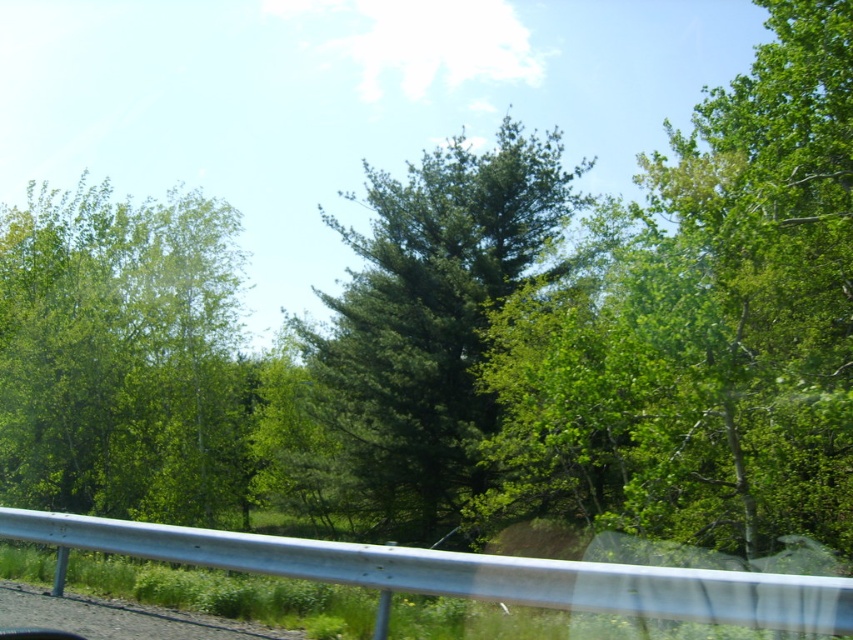
Describe the element at coordinates (701, 324) in the screenshot. I see `green leafy tree at center` at that location.

Between green leafy tree at center and green leafy tree at left, which one has more height?

With more height is green leafy tree at center.

Who is more distant from viewer, (711, 266) or (158, 333)?

The point (158, 333) is more distant.

I want to click on green leafy tree at center, so click(x=701, y=324).

Does green leafy tree at left have a larger size compared to green matte tree at center?

Indeed, green leafy tree at left has a larger size compared to green matte tree at center.

Does green leafy tree at left appear on the right side of green matte tree at center?

No, green leafy tree at left is not to the right of green matte tree at center.

Identify the location of green leafy tree at left. (120, 355).

Is green leafy tree at center closer to the viewer compared to green matte tree at center?

Yes, green leafy tree at center is closer to the viewer.

Is green leafy tree at center above green matte tree at center?

Yes.

Is point (689, 317) farther from camera compared to point (473, 189)?

No, it is in front of (473, 189).

At what (x,y) coordinates should I click in order to perform the action: click on green leafy tree at center. Please return your answer as a coordinate pair (x, y). Image resolution: width=853 pixels, height=640 pixels. Looking at the image, I should click on (701, 324).